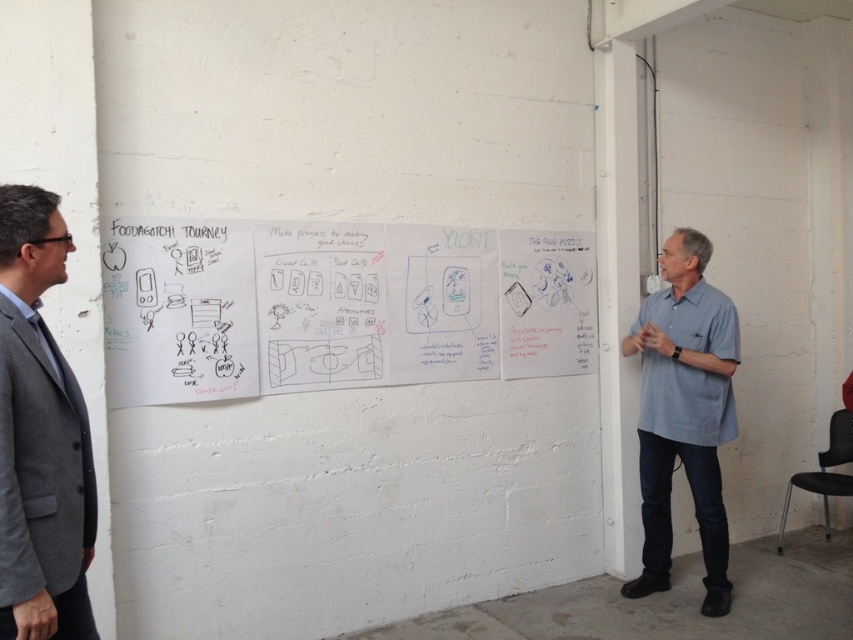
You are standing in the room and need to place a new document between the white paper at center and the gray wool suit at left. Where should you place it?

The white paper at center is to the right of the gray wool suit at left, so you should place the new document between them to the right of the gray wool suit at left and to the left of the white paper at center.

You are a presenter standing at the front of the room. You need to reach both the white paper at center and the light blue shirt at right during your presentation. Considering your arm length is 28 inches, can you comfortably reach both items without moving your feet?

The distance between the white paper at center and the light blue shirt at right is 36.54 inches. Since your arm length is 28 inches, you cannot comfortably reach both items without moving your feet as the distance exceeds your arm span.